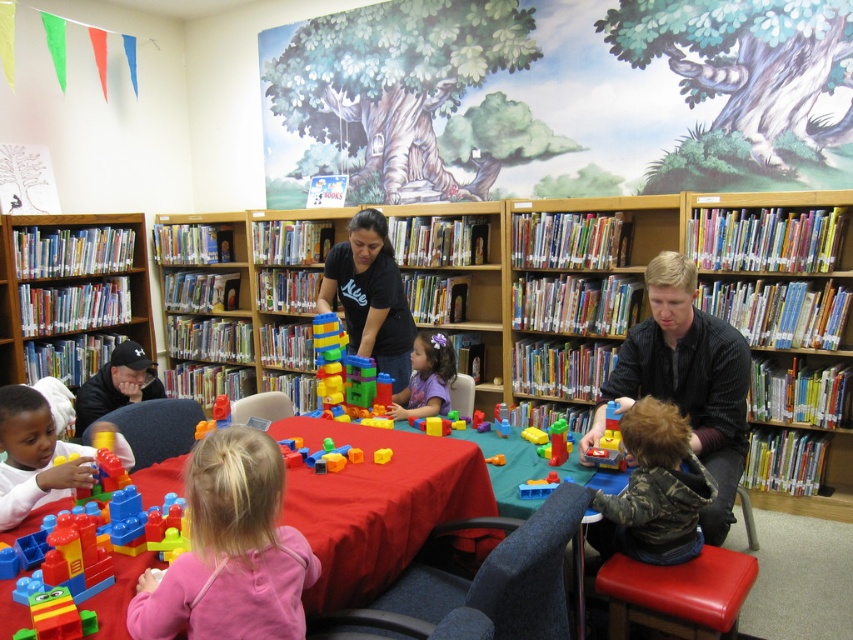
Question: Does pink fabric shirt at lower center come in front of dark gray sweater at center?

Choices:
 (A) no
 (B) yes

Answer: (B)

Question: Which point is closer to the camera?

Choices:
 (A) wooden bookshelf at center
 (B) dark gray sweater at center

Answer: (B)

Question: Which point is closer to the camera?

Choices:
 (A) black matte shirt at center
 (B) brick-like plastic blocks at center
 (C) camouflage fabric shirt at lower right
 (D) wooden bookshelf at center

Answer: (B)

Question: Which object is positioned closest to the red fabric table at center?

Choices:
 (A) wooden bookshelf at center
 (B) translucent plastic toy at center
 (C) matte plastic blocks at lower left

Answer: (B)

Question: Does camouflage fabric shirt at lower right lie behind black matte shirt at center?

Choices:
 (A) no
 (B) yes

Answer: (A)

Question: Does red fabric table at center have a greater width compared to pink fabric shirt at lower center?

Choices:
 (A) yes
 (B) no

Answer: (A)